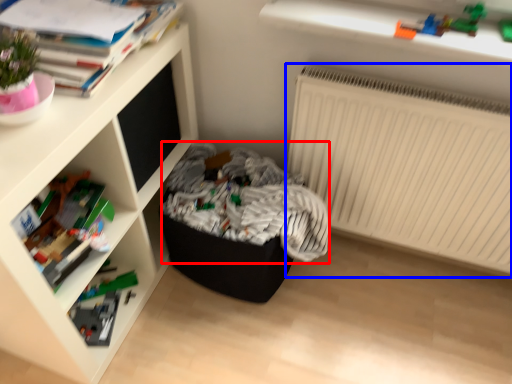
Question: Among these objects, which one is farthest to the camera, laundry (highlighted by a red box) or radiator (highlighted by a blue box)?

Choices:
 (A) laundry
 (B) radiator

Answer: (A)